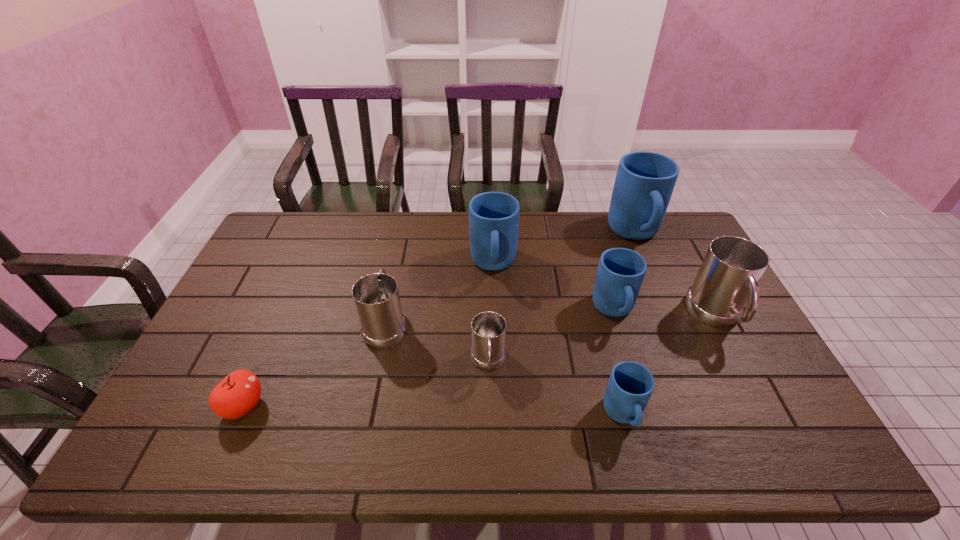
This screenshot has height=540, width=960. Find the location of `vacant space located on the right of the leftmost object`. vacant space located on the right of the leftmost object is located at coordinates (289, 406).

The height and width of the screenshot is (540, 960). Identify the location of mug that is at the near edge. (630, 385).

This screenshot has width=960, height=540. In order to click on apple that is positioned at the near edge in this screenshot , I will do `click(237, 394)`.

I want to click on object that is at the left edge, so click(x=237, y=394).

This screenshot has height=540, width=960. I want to click on object present at the near left corner, so click(237, 394).

Find the location of a particular element. object located in the far right corner section of the desktop is located at coordinates point(644,183).

You are a GUI agent. You are given a task and a screenshot of the screen. Output one action in this format:
    pyautogui.click(x=<x>, y=<y>)
    Task: Click on the free region at the far edge of the desktop
    
    Given the screenshot: What is the action you would take?
    (466, 245)

You are a GUI agent. You are given a task and a screenshot of the screen. Output one action in this format:
    pyautogui.click(x=<x>, y=<y>)
    Task: Click on the free space at the near edge of the desktop
    
    Given the screenshot: What is the action you would take?
    pyautogui.click(x=268, y=433)

In the image, there is a desktop. Where is `vacant space at the left edge`? vacant space at the left edge is located at coordinates (252, 327).

The height and width of the screenshot is (540, 960). In order to click on free space at the right edge of the desktop in this screenshot , I will do `click(700, 263)`.